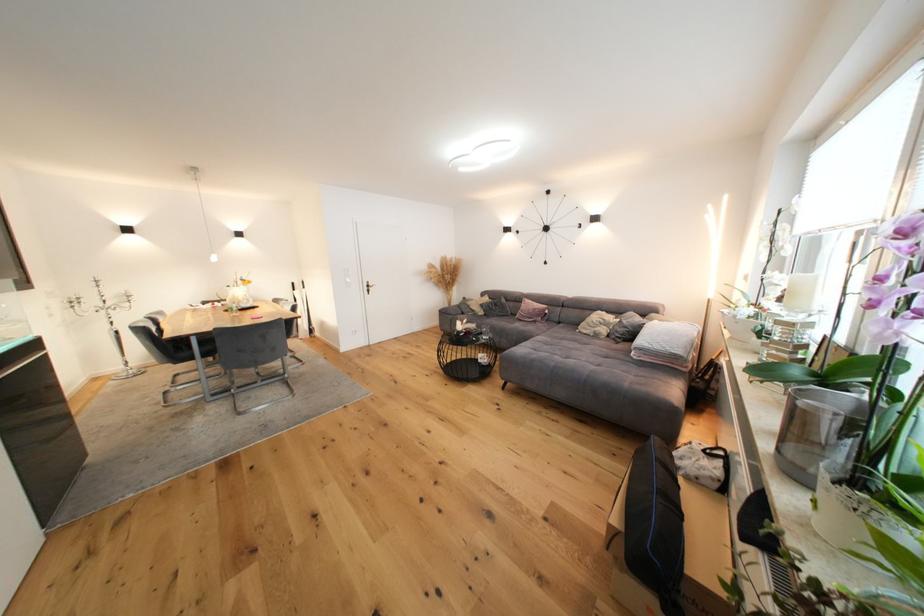
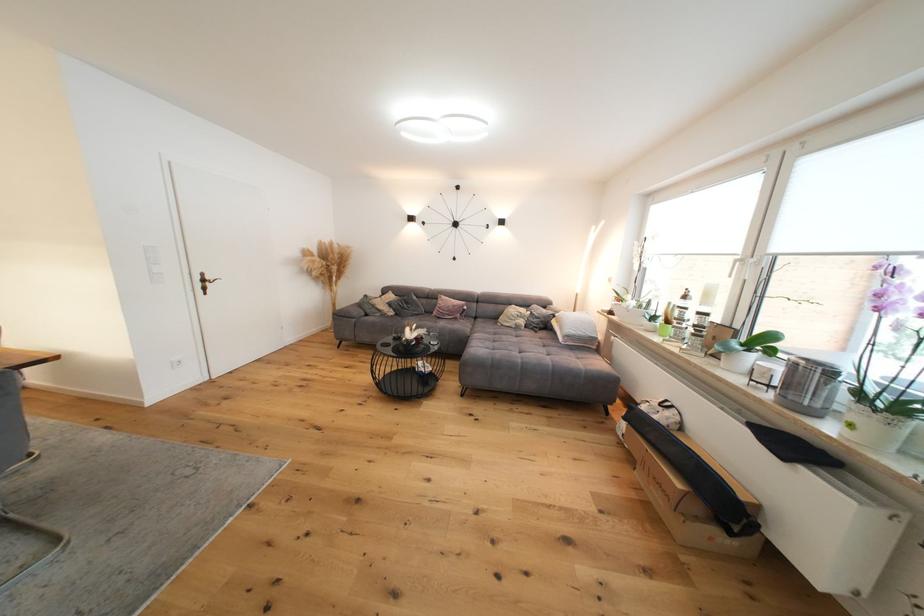
Where in the second image is the point corresponding to the point at 611,331 from the first image?

(529, 323)